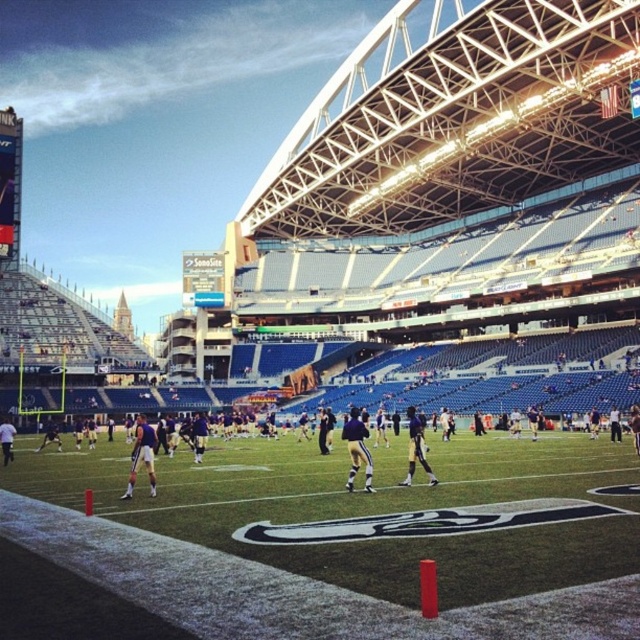
Question: Which point is farther to the camera?

Choices:
 (A) (564, 516)
 (B) (304, 445)

Answer: (B)

Question: Does green artificial turf at lower left have a greater width compared to gold metallic uniform at center?

Choices:
 (A) no
 (B) yes

Answer: (A)

Question: Can you confirm if green artificial turf at lower left is positioned above gold metallic uniform at center?

Choices:
 (A) yes
 (B) no

Answer: (B)

Question: Which of the following is the closest to the observer?

Choices:
 (A) gold metallic uniform at center
 (B) green artificial turf at lower left

Answer: (B)

Question: Does green artificial turf at lower left have a lesser width compared to gold metallic uniform at center?

Choices:
 (A) no
 (B) yes

Answer: (B)